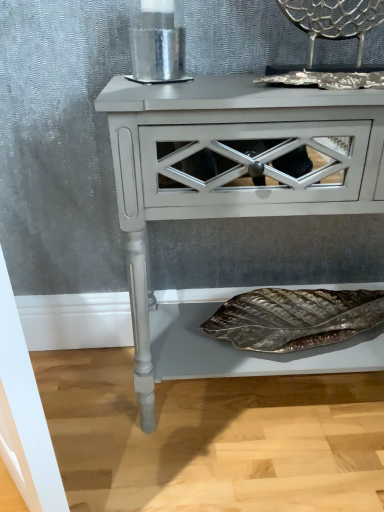
Question: Considering the positions of matte white nightstand at center and metallic silver chair at upper right in the image, is matte white nightstand at center wider or thinner than metallic silver chair at upper right?

Choices:
 (A) wide
 (B) thin

Answer: (A)

Question: Does point (178, 153) appear closer or farther from the camera than point (367, 2)?

Choices:
 (A) closer
 (B) farther

Answer: (A)

Question: Considering the positions of matte white nightstand at center and metallic silver chair at upper right in the image, is matte white nightstand at center taller or shorter than metallic silver chair at upper right?

Choices:
 (A) tall
 (B) short

Answer: (A)

Question: Considering the positions of metallic silver chair at upper right and matte white nightstand at center in the image, is metallic silver chair at upper right wider or thinner than matte white nightstand at center?

Choices:
 (A) thin
 (B) wide

Answer: (A)

Question: Is metallic silver chair at upper right inside the boundaries of matte white nightstand at center, or outside?

Choices:
 (A) outside
 (B) inside

Answer: (A)

Question: Based on their sizes in the image, would you say metallic silver chair at upper right is bigger or smaller than matte white nightstand at center?

Choices:
 (A) big
 (B) small

Answer: (B)

Question: Relative to matte white nightstand at center, is metallic silver chair at upper right in front or behind?

Choices:
 (A) front
 (B) behind

Answer: (B)